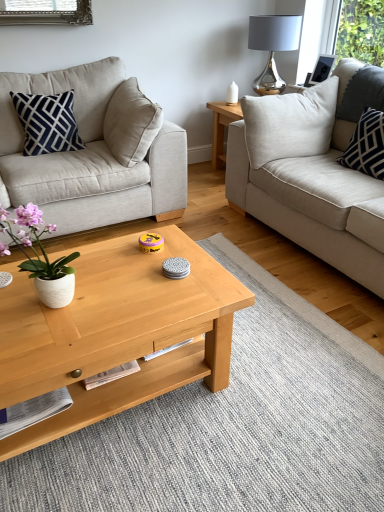
Question: Does point [327, 179] appear closer or farther from the camera than point [114, 82]?

Choices:
 (A) closer
 (B) farther

Answer: (A)

Question: In the image, is light gray fabric couch at right, acting as the 1th studio couch starting from the right, positioned in front of or behind beige fabric couch at left, which is the second studio couch from right to left?

Choices:
 (A) front
 (B) behind

Answer: (A)

Question: Which is farther from the shiny metallic lamp at upper right?

Choices:
 (A) beige fabric couch at left, which is the second studio couch from right to left
 (B) light wood/texture coffee table at center
 (C) navy blue fabric pillow at left, which appears as the 2th pillow when viewed from the right
 (D) white textured pillow at right, which appears as the second pillow when viewed from the left
 (E) white ceramic pot at left

Answer: (B)

Question: Which object is positioned farthest from the light gray fabric couch at right, acting as the 1th studio couch starting from the right?

Choices:
 (A) light wood/texture coffee table at center
 (B) white ceramic pot at left
 (C) white textured pillow at right, which appears as the second pillow when viewed from the left
 (D) shiny metallic lamp at upper right
 (E) navy blue fabric pillow at left, marked as the 1th pillow in a left-to-right arrangement

Answer: (B)